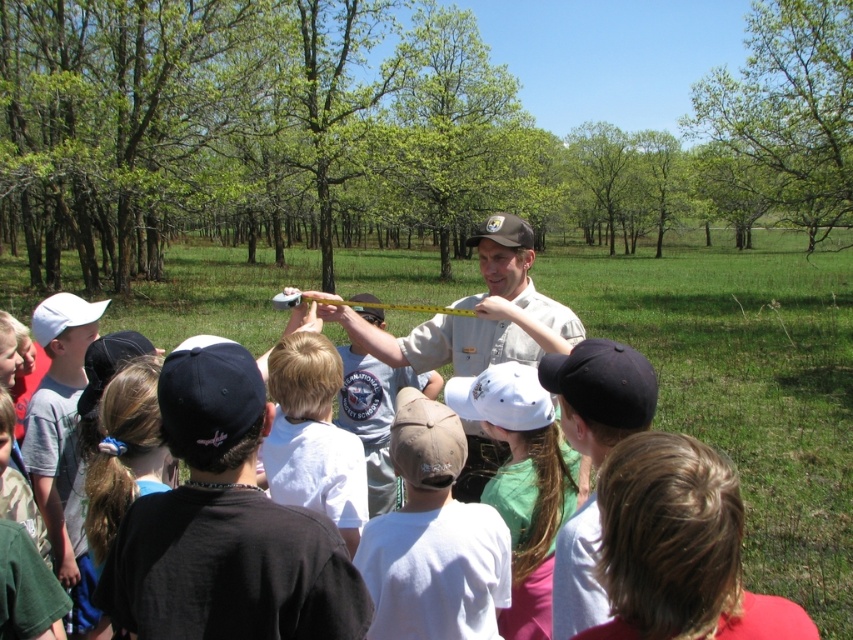
Which is below, black matte baseball cap at center or white matte baseball cap at left?

black matte baseball cap at center

Is point (654, 403) positioned behind point (86, 314)?

No, it is not.

Where is `black matte baseball cap at center`? The image size is (853, 640). black matte baseball cap at center is located at coordinates (602, 381).

Which is behind, point (520, 394) or point (355, 300)?

The point (355, 300) is behind.

Where is `white matte baseball cap at center`? This screenshot has height=640, width=853. white matte baseball cap at center is located at coordinates (502, 397).

Is point (428, 474) farther from camera compared to point (372, 296)?

No, (428, 474) is closer to viewer.

Who is taller, brown fabric baseball cap at center or matte brown baseball cap at center?

With more height is matte brown baseball cap at center.

Where is `brown fabric baseball cap at center`? This screenshot has height=640, width=853. brown fabric baseball cap at center is located at coordinates (425, 442).